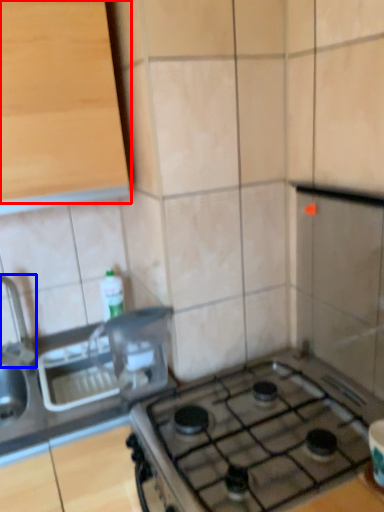
Question: Among these objects, which one is nearest to the camera, cabinetry (highlighted by a red box) or faucet (highlighted by a blue box)?

Choices:
 (A) cabinetry
 (B) faucet

Answer: (A)